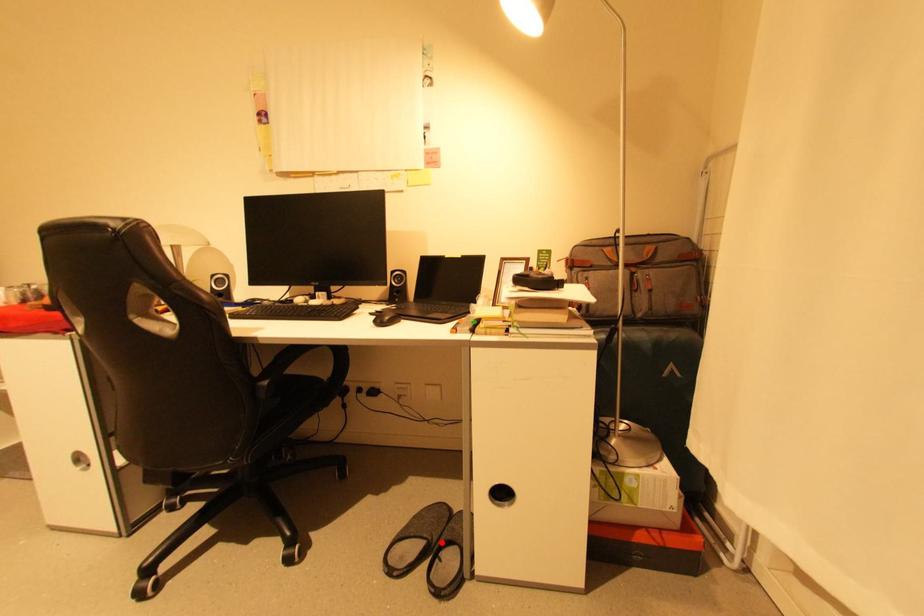
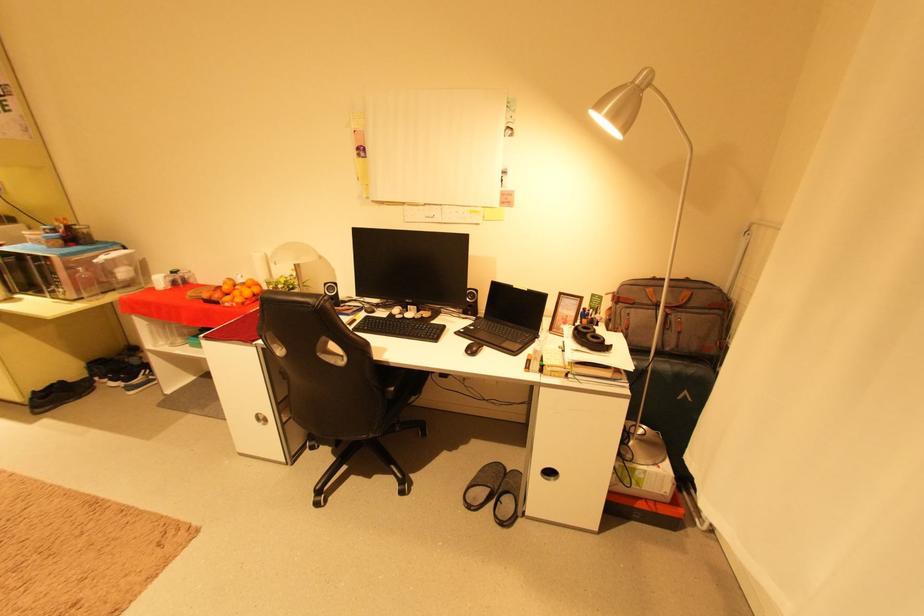
Question: I am providing you with two images of the same scene from different viewpoints. A red point is marked on the first image. Can you still see the location of the red point in image 2?

Choices:
 (A) Yes
 (B) No

Answer: (A)